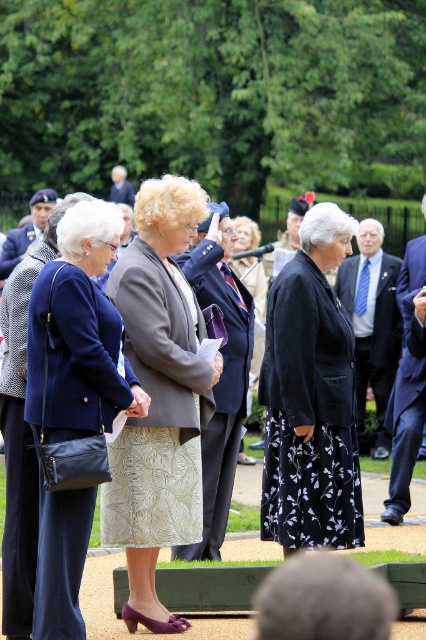
Is purple fabric skirt at center taller than black floral skirt at center?

Yes.

Who is more forward, (131, 588) or (301, 452)?

Point (131, 588)

Does point (192, 227) lie in front of point (354, 536)?

That is True.

Find the location of a particular element. purple fabric skirt at center is located at coordinates (158, 397).

Which is in front, point (222, 451) or point (91, 593)?

Point (91, 593)

Which of these two, matte gray blazer at center or matte black jacket at center, stands shorter?

With less height is matte black jacket at center.

Does point (241, 372) come farther from viewer compared to point (20, 349)?

Yes, point (241, 372) is farther from viewer.

You are a GUI agent. You are given a task and a screenshot of the screen. Output one action in this format:
    pyautogui.click(x=<x>, y=<y>)
    Task: Click on the matte gray blazer at center
    The width and height of the screenshot is (426, 640).
    Given the screenshot: What is the action you would take?
    pyautogui.click(x=219, y=374)

Can you confirm if black floral skirt at center is positioned below navy blue fabric coat at center?

Yes.

Between black floral skirt at center and navy blue fabric coat at center, which one is positioned higher?

navy blue fabric coat at center is above.

Between point (290, 504) and point (40, 566), which one is positioned in front?

Positioned in front is point (40, 566).

Where is `black floral skirt at center`? The width and height of the screenshot is (426, 640). black floral skirt at center is located at coordinates (310, 397).